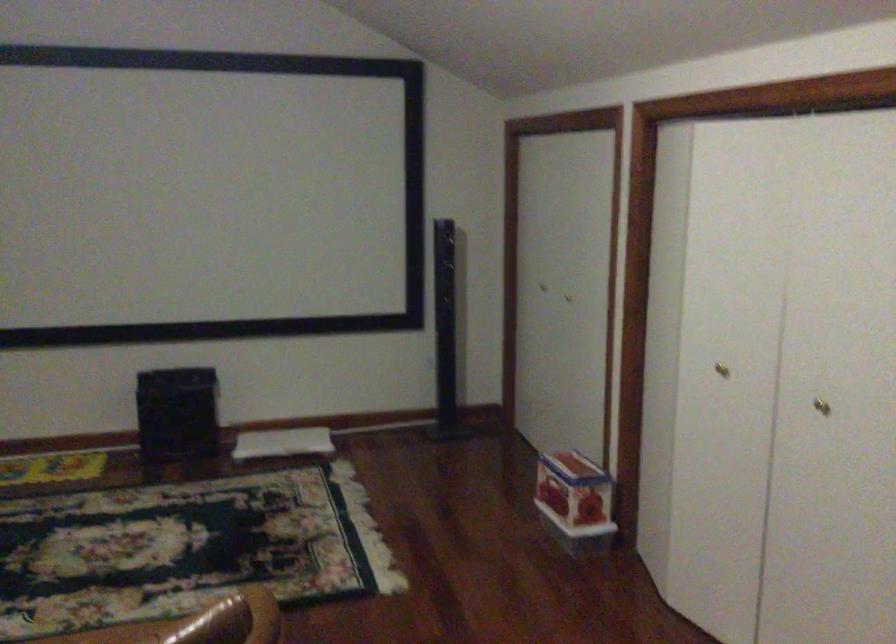
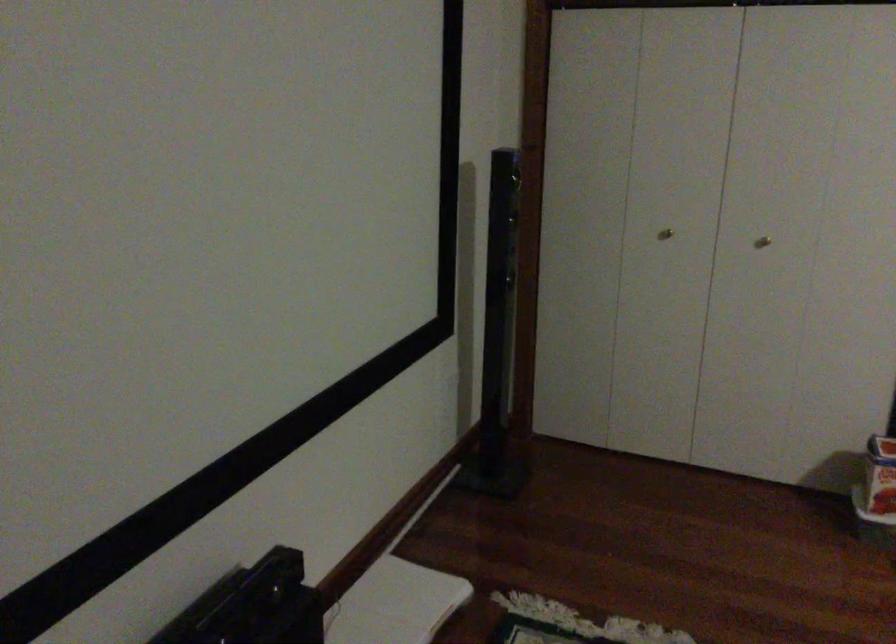
The point at (567, 299) is marked in the first image. Where is the corresponding point in the second image?

(762, 242)